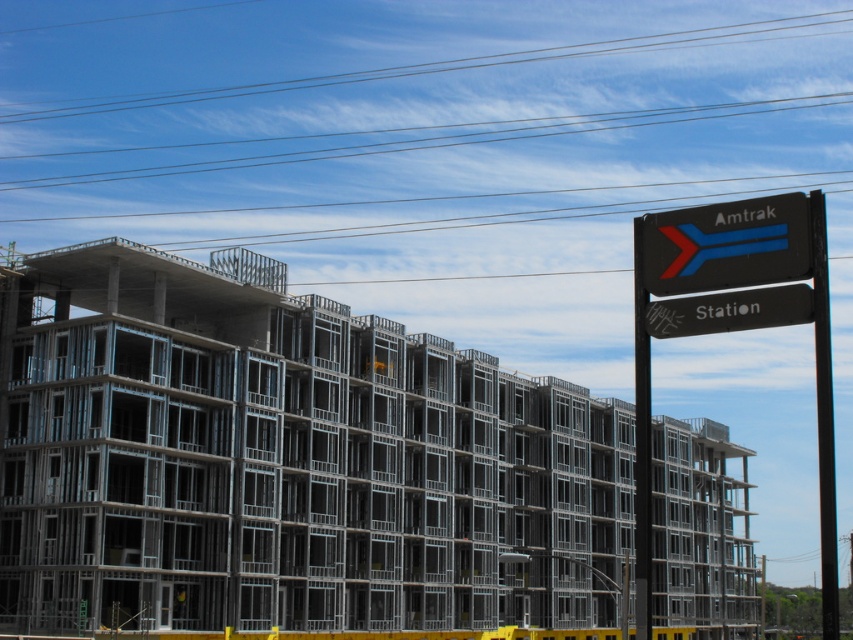
You are standing at the construction site and want to take a photo of the building. There are two points marked on the steel framework at coordinates point [102,396] and point [643,378]. Which point will appear closer to the camera in your photo?

Point [102,396] is further to the camera than point [643,378], so it will appear closer in the photo.

You are a delivery truck driver who needs to park your truck between the black plastic sign at upper right and the black metal pole at right. Your truck is 15 meters long. Can you park your truck there?

The distance between the black plastic sign at upper right and the black metal pole at right is 43.29 meters. Since your truck is only 15 meters long, there is sufficient space to park it between them.

You are standing at the construction site and want to know which of the two points, point (682,243) or point (827,401), is closer to you. Which one is closer?

Point (682,243) is closer to you because it is further to the viewer than point (827,401).